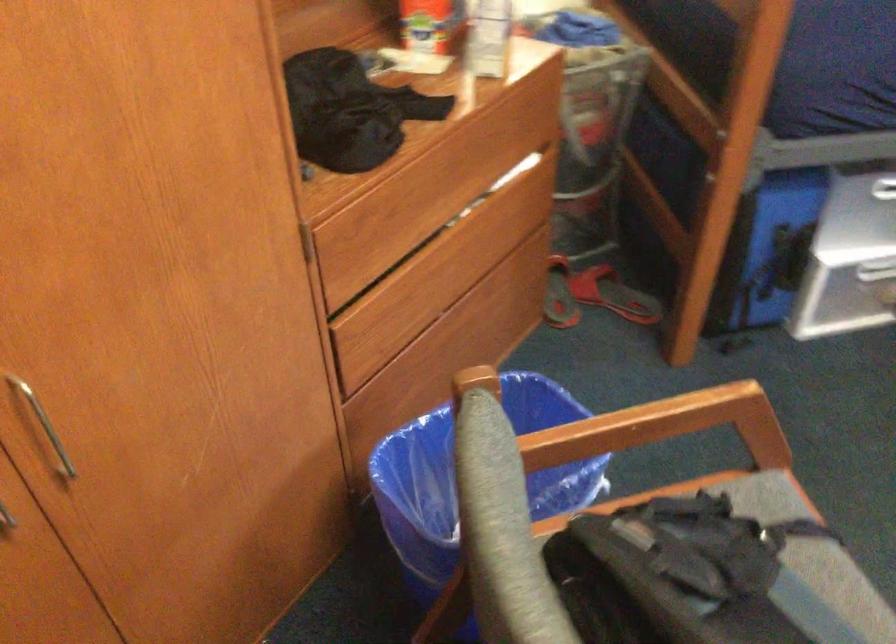
Find where to sit the chair sitting surface. Please return your answer as a coordinate pair (x, y).

(769, 504)